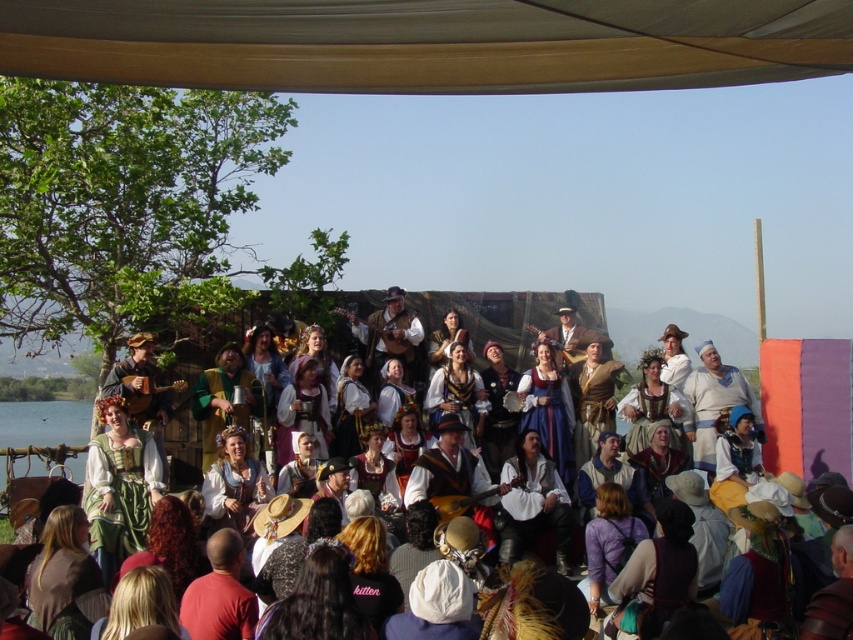
Question: Can you confirm if gray fabric canopy at upper center is positioned above white cotton dress at center?

Choices:
 (A) no
 (B) yes

Answer: (B)

Question: Does gray fabric canopy at upper center come in front of white cotton dress at center?

Choices:
 (A) no
 (B) yes

Answer: (B)

Question: Does gray fabric canopy at upper center appear under white cotton dress at center?

Choices:
 (A) yes
 (B) no

Answer: (B)